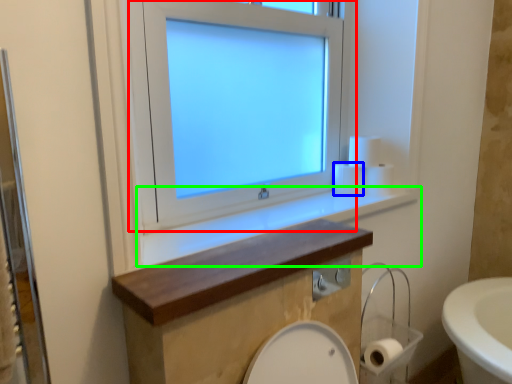
Question: Estimate the real-world distances between objects in this image. Which object is farther from window (highlighted by a red box), toilet paper (highlighted by a blue box) or window sill (highlighted by a green box)?

Choices:
 (A) toilet paper
 (B) window sill

Answer: (A)